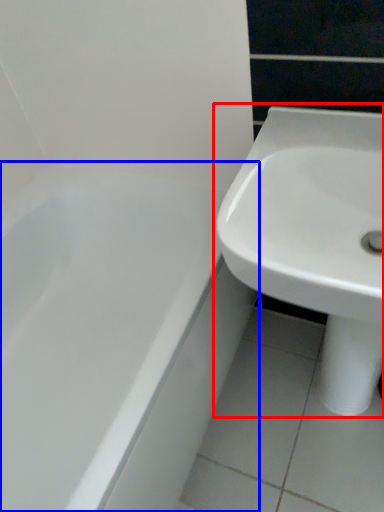
Question: Which point is further to the camera, sink (highlighted by a red box) or bathtub (highlighted by a blue box)?

Choices:
 (A) sink
 (B) bathtub

Answer: (B)